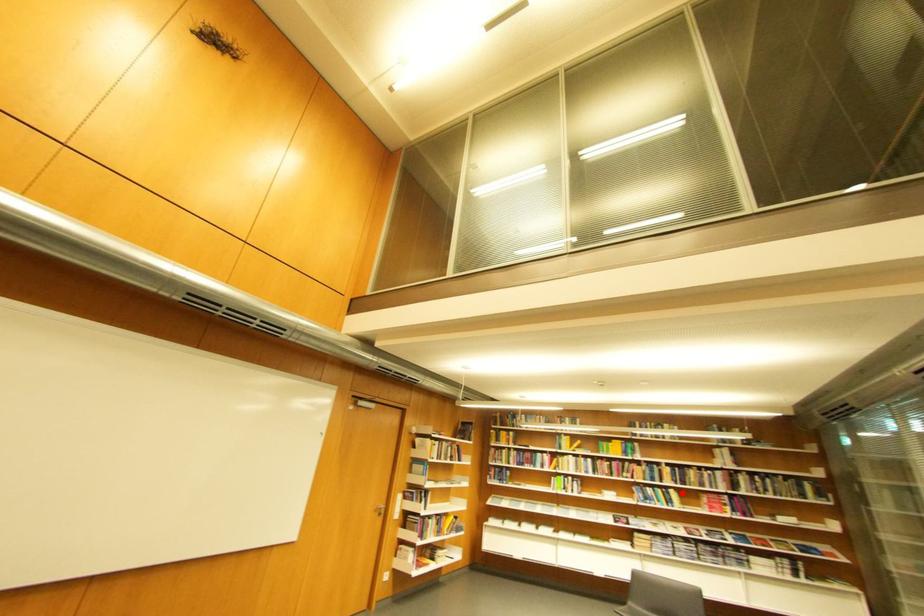
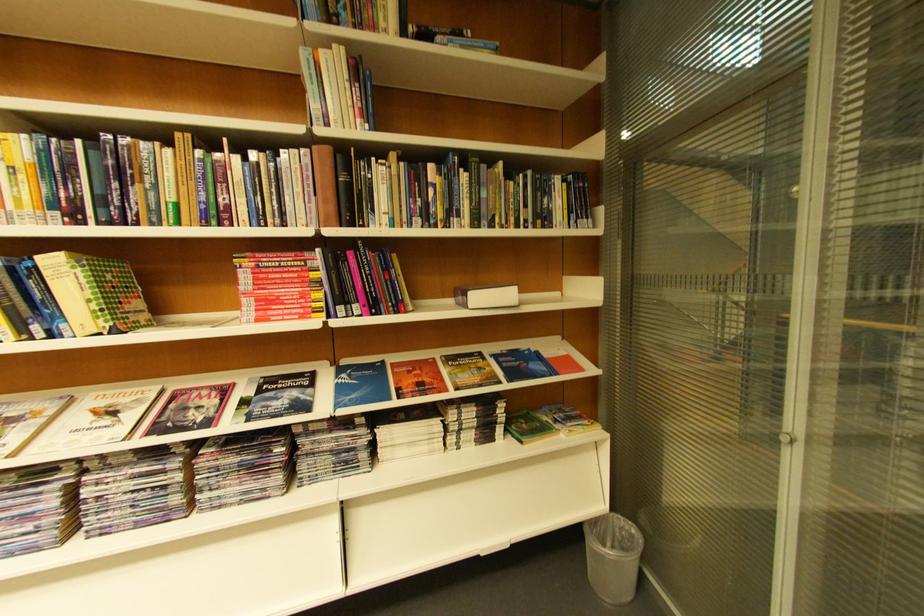
Where in the second image is the point corresponding to the highlighted location from the first image?

(63, 264)